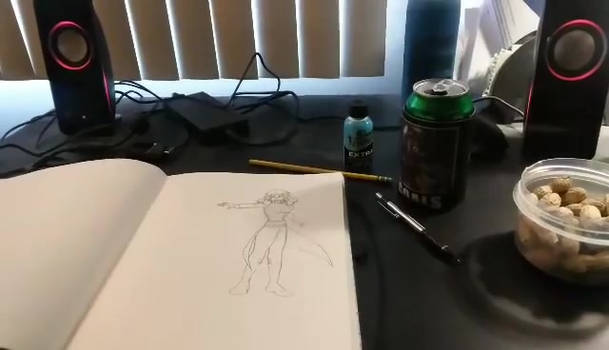
At what (x,y) coordinates should I click in order to perform the action: click on plastic container. Please return your answer as a coordinate pair (x, y). Looking at the image, I should click on (558, 242).